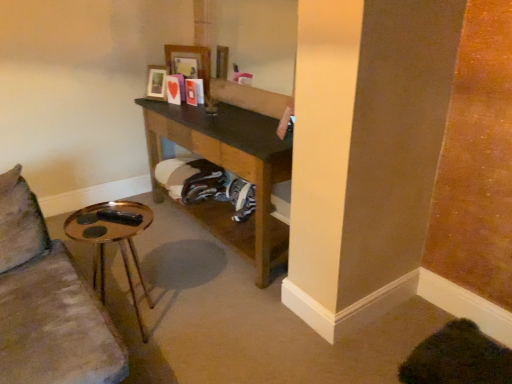
Question: Looking at their shapes, would you say wooden photo frame at upper center, the 1th picture frame in the left-to-right sequence, is wider or thinner than gold metallic side table at lower left?

Choices:
 (A) thin
 (B) wide

Answer: (A)

Question: Do you think wooden photo frame at upper center, the 2th picture frame from the right, is within gold metallic side table at lower left, or outside of it?

Choices:
 (A) outside
 (B) inside

Answer: (A)

Question: Considering the real-world distances, which object is closest to the wooden picture frame at upper center, placed as the first picture frame when sorted from right to left?

Choices:
 (A) gold metallic side table at lower left
 (B) brown wooden shelf at center
 (C) wooden photo frame at upper center, the 1th picture frame in the left-to-right sequence

Answer: (C)

Question: Estimate the real-world distances between objects in this image. Which object is farther from the wooden picture frame at upper center, placed as the first picture frame when sorted from right to left?

Choices:
 (A) gold metallic side table at lower left
 (B) wooden photo frame at upper center, the 1th picture frame in the left-to-right sequence
 (C) brown wooden shelf at center

Answer: (A)